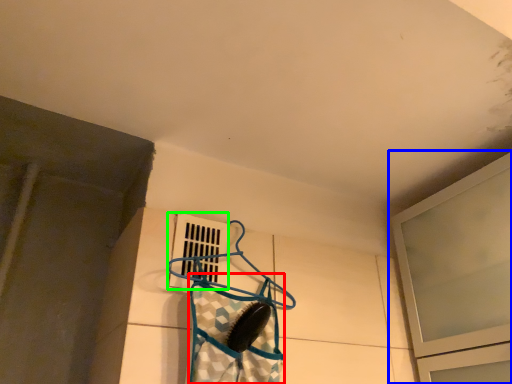
Question: Considering the real-world distances, which object is farthest from clothing (highlighted by a red box)? window (highlighted by a blue box) or window (highlighted by a green box)?

Choices:
 (A) window
 (B) window

Answer: (A)